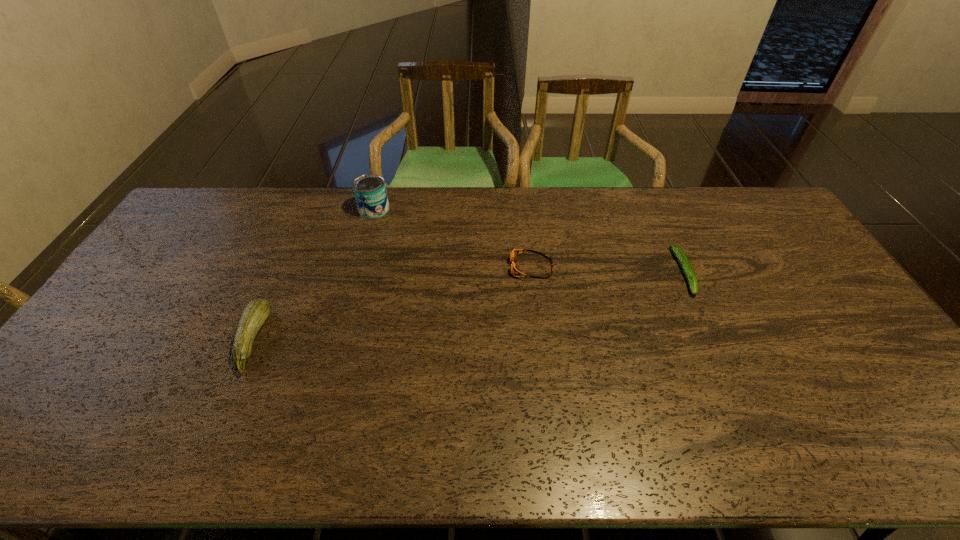
This screenshot has height=540, width=960. Find the location of `vacant space located 0.330m with the lenses facing forward on the third tallest object`. vacant space located 0.330m with the lenses facing forward on the third tallest object is located at coordinates (406, 267).

You are a GUI agent. You are given a task and a screenshot of the screen. Output one action in this format:
    pyautogui.click(x=<x>, y=<y>)
    Task: Click on the free space located with the lenses facing forward on the third tallest object
    
    Given the screenshot: What is the action you would take?
    pyautogui.click(x=419, y=267)

Identify the location of vacant space located 0.240m with the lenses facing forward on the third tallest object. This screenshot has width=960, height=540. (435, 267).

The image size is (960, 540). Identify the location of free space located 0.060m on the front-facing side of the right zucchini. (704, 314).

Image resolution: width=960 pixels, height=540 pixels. Identify the location of object that is positioned at the far edge. (370, 192).

The width and height of the screenshot is (960, 540). What are the coordinates of `blank space at the far edge of the desktop` in the screenshot? It's located at (516, 215).

In the image, there is a desktop. Identify the location of vacant region at the left edge. The width and height of the screenshot is (960, 540). (157, 278).

You are a GUI agent. You are given a task and a screenshot of the screen. Output one action in this format:
    pyautogui.click(x=<x>, y=<y>)
    Task: Click on the free space at the right edge of the desktop
    Image resolution: width=960 pixels, height=540 pixels.
    Given the screenshot: What is the action you would take?
    pyautogui.click(x=847, y=357)

In the image, there is a desktop. What are the coordinates of `vacant space at the near left corner` in the screenshot? It's located at (58, 454).

You are a GUI agent. You are given a task and a screenshot of the screen. Output one action in this format:
    pyautogui.click(x=<x>, y=<y>)
    Task: Click on the vacant space in between the third tallest object and the nearest object
    This screenshot has height=540, width=960.
    Given the screenshot: What is the action you would take?
    pyautogui.click(x=392, y=304)